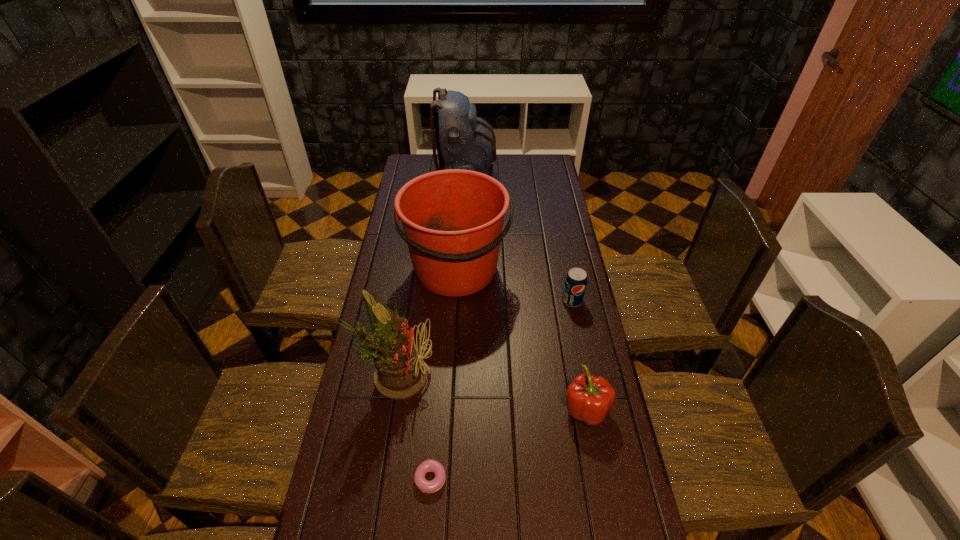
The height and width of the screenshot is (540, 960). Identify the location of vacant space situated 0.280m on the front of the pop. (588, 376).

The width and height of the screenshot is (960, 540). What are the coordinates of `vacant position located on the left of the pepper` in the screenshot? It's located at (511, 409).

Where is `vacant space located on the left of the nearest object`? This screenshot has height=540, width=960. vacant space located on the left of the nearest object is located at coordinates (391, 479).

Where is `object located at the far edge`? The height and width of the screenshot is (540, 960). object located at the far edge is located at coordinates (464, 141).

Locate an element on the screen. flower arrangement positioned at the left edge is located at coordinates (401, 372).

Where is `bucket present at the left edge`? Image resolution: width=960 pixels, height=540 pixels. bucket present at the left edge is located at coordinates (452, 219).

Locate an element on the screen. The width and height of the screenshot is (960, 540). pop present at the right edge is located at coordinates (575, 283).

Locate an element on the screen. This screenshot has width=960, height=540. pepper present at the right edge is located at coordinates (589, 398).

At what (x,y) coordinates should I click in order to perform the action: click on vacant space at the far edge. Please return your answer as a coordinate pair (x, y). The image size is (960, 540). Looking at the image, I should click on (497, 163).

Identify the location of free region at the right edge of the desktop. (563, 219).